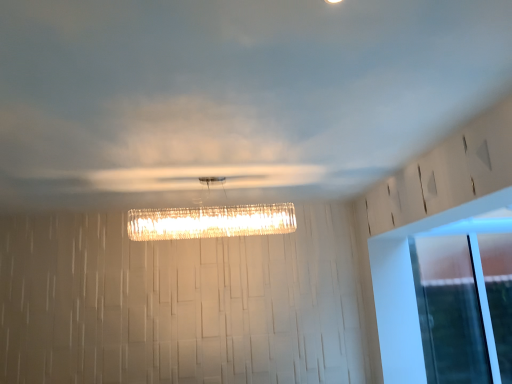
The image size is (512, 384). What are the coordinates of `translucent glass rectangular light fixture at center` in the screenshot? It's located at (211, 222).

Image resolution: width=512 pixels, height=384 pixels. What do you see at coordinates (211, 222) in the screenshot?
I see `translucent glass rectangular light fixture at center` at bounding box center [211, 222].

Find the location of `translucent glass rectangular light fixture at center`. translucent glass rectangular light fixture at center is located at coordinates (211, 222).